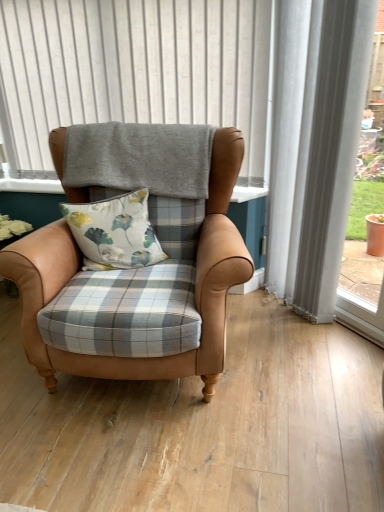
Question: Would you say leather armchair at center is to the left or to the right of gray fabric at upper center in the picture?

Choices:
 (A) right
 (B) left

Answer: (A)

Question: Relative to gray fabric at upper center, is leather armchair at center in front or behind?

Choices:
 (A) front
 (B) behind

Answer: (A)

Question: Estimate the real-world distances between objects in this image. Which object is closer to the leather armchair at center?

Choices:
 (A) floral fabric cushion at center
 (B) gray fabric at upper center

Answer: (A)

Question: Which of these objects is positioned farthest from the gray fabric at upper center?

Choices:
 (A) floral fabric cushion at center
 (B) leather armchair at center

Answer: (A)